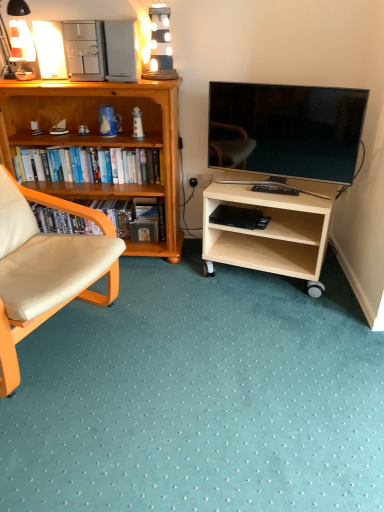
Question: From the image's perspective, is hardcover books at left, the first book viewed from the top, located beneath matte black tv at right?

Choices:
 (A) yes
 (B) no

Answer: (A)

Question: Is hardcover books at left, which ranks as the 2th book in bottom-to-top order, at the left side of matte black tv at right?

Choices:
 (A) yes
 (B) no

Answer: (A)

Question: Is hardcover books at left, the first book viewed from the top, looking in the opposite direction of matte black tv at right?

Choices:
 (A) no
 (B) yes

Answer: (A)

Question: Is hardcover books at left, the first book viewed from the top, at the right side of matte black tv at right?

Choices:
 (A) no
 (B) yes

Answer: (A)

Question: Does hardcover books at left, which ranks as the 2th book in bottom-to-top order, lie behind matte black tv at right?

Choices:
 (A) yes
 (B) no

Answer: (A)

Question: Considering the positions of point (140, 206) and point (0, 86), is point (140, 206) closer or farther from the camera than point (0, 86)?

Choices:
 (A) farther
 (B) closer

Answer: (A)

Question: Considering the positions of black matte bookshelf at left, which is the first book in bottom-to-top order, and wooden bookshelf at left, positioned as the 2th desk in right-to-left order, in the image, is black matte bookshelf at left, which is the first book in bottom-to-top order, taller or shorter than wooden bookshelf at left, positioned as the 2th desk in right-to-left order,?

Choices:
 (A) short
 (B) tall

Answer: (A)

Question: In terms of width, does black matte bookshelf at left, which is the first book in bottom-to-top order, look wider or thinner when compared to wooden bookshelf at left, positioned as the 2th desk in right-to-left order?

Choices:
 (A) wide
 (B) thin

Answer: (B)

Question: From a real-world perspective, is black matte bookshelf at left, which is the first book in bottom-to-top order, physically located above or below wooden bookshelf at left, which appears as the first desk when viewed from the left?

Choices:
 (A) below
 (B) above

Answer: (A)

Question: Does point (139, 181) appear closer or farther from the camera than point (109, 97)?

Choices:
 (A) closer
 (B) farther

Answer: (B)

Question: From the image's perspective, is hardcover books at left, the first book viewed from the top, located above or below wooden bookshelf at left, which appears as the first desk when viewed from the left?

Choices:
 (A) above
 (B) below

Answer: (A)

Question: Based on their positions, is hardcover books at left, which ranks as the 2th book in bottom-to-top order, located to the left or right of wooden bookshelf at left, positioned as the 2th desk in right-to-left order?

Choices:
 (A) right
 (B) left

Answer: (B)

Question: Is hardcover books at left, the first book viewed from the top, inside the boundaries of wooden bookshelf at left, which appears as the first desk when viewed from the left, or outside?

Choices:
 (A) outside
 (B) inside

Answer: (B)

Question: Considering the positions of matte white lamp at upper left and black matte bookshelf at left, which is the first book in bottom-to-top order, in the image, is matte white lamp at upper left taller or shorter than black matte bookshelf at left, which is the first book in bottom-to-top order,?

Choices:
 (A) tall
 (B) short

Answer: (A)

Question: Based on their sizes in the image, would you say matte white lamp at upper left is bigger or smaller than black matte bookshelf at left, the second book in the top-to-bottom sequence?

Choices:
 (A) big
 (B) small

Answer: (B)